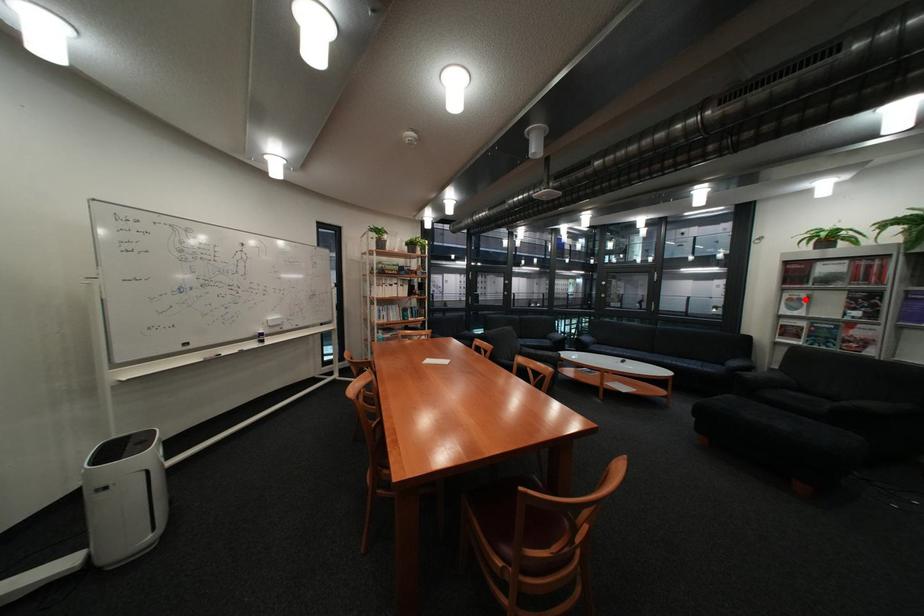
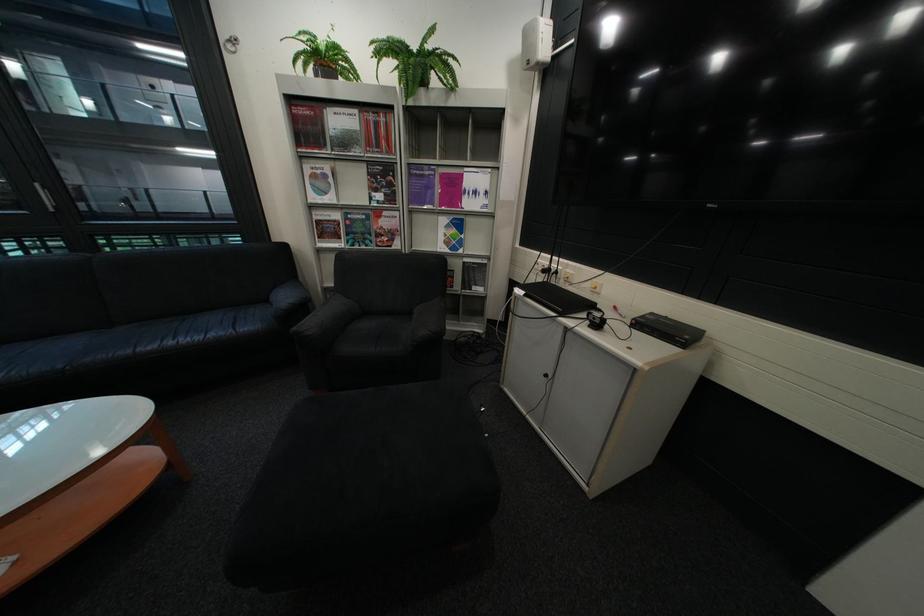
Find the pixel in the second image that matches the highlighted location in the first image.

(329, 177)